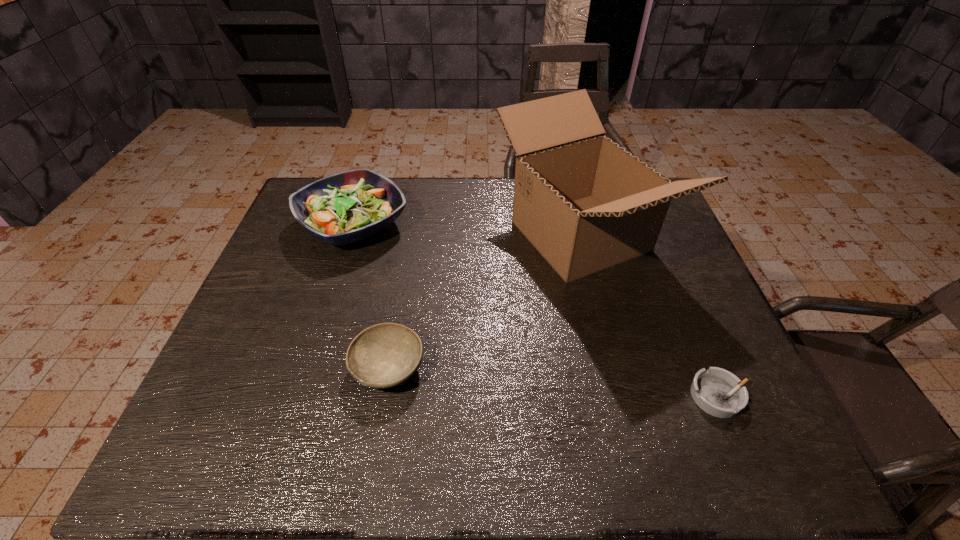
At what (x,y) coordinates should I click in order to perform the action: click on box. Please return your answer as a coordinate pair (x, y). Looking at the image, I should click on (585, 203).

Identify the location of the second tallest object. (349, 206).

This screenshot has height=540, width=960. What are the coordinates of `bowl` in the screenshot? It's located at (385, 355).

Locate an element on the screen. The height and width of the screenshot is (540, 960). the shortest object is located at coordinates (718, 392).

This screenshot has width=960, height=540. Find the location of `blank area located 0.210m on the left of the tallest object`. blank area located 0.210m on the left of the tallest object is located at coordinates (423, 236).

Where is `vacant space located 0.320m on the front of the second tallest object`? vacant space located 0.320m on the front of the second tallest object is located at coordinates (309, 360).

Where is `free region located on the back of the third tallest object`? This screenshot has width=960, height=540. free region located on the back of the third tallest object is located at coordinates (411, 235).

At what (x,y) coordinates should I click in order to perform the action: click on vacant space situated on the left of the ashtray. Please return your answer as a coordinate pair (x, y). Image resolution: width=960 pixels, height=540 pixels. Looking at the image, I should click on (629, 396).

The width and height of the screenshot is (960, 540). I want to click on box positioned at the far edge, so click(x=585, y=203).

What are the coordinates of `salad plate at the far edge` in the screenshot? It's located at (x=349, y=206).